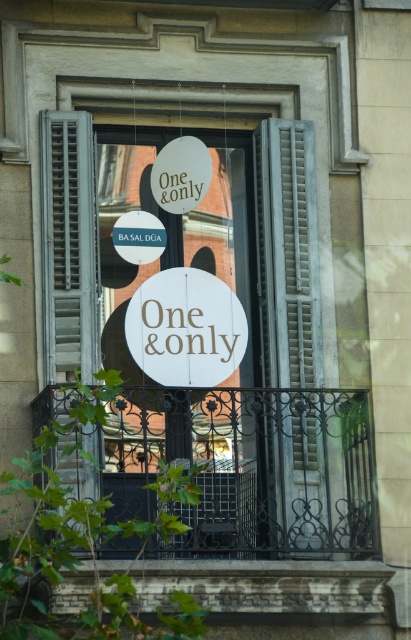
You are standing in front of the building and want to measure the distance between the gray textured shutter at right and the nearest building across the street. Can you estimate how far apart they are?

The gray textured shutter at right is 57.09 meters away from the nearest building across the street.

You are standing in front of the building and looking at the three circular signs hanging from the window. There are two points marked on the window frame at coordinates point [53,218] and point [150,378]. Which point is closer to you?

Point [53,218] is further to the camera than point [150,378], so the point closer to you is point [150,378].